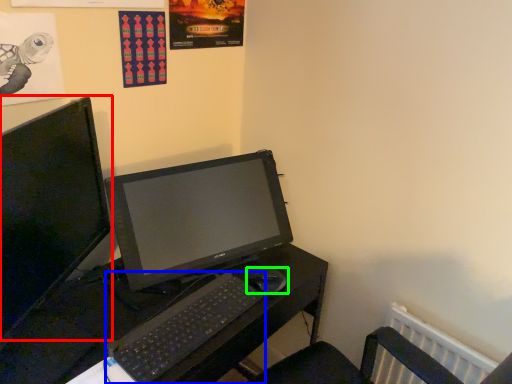
Question: Based on their relative distances, which object is farther from computer monitor (highlighted by a red box)? Choose from computer keyboard (highlighted by a blue box) and mouse (highlighted by a green box).

Choices:
 (A) computer keyboard
 (B) mouse

Answer: (B)